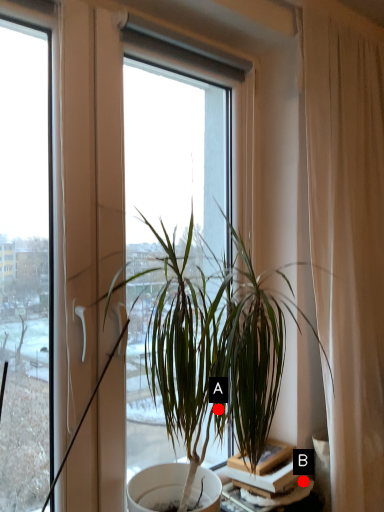
Question: Two points are circled on the image, labeled by A and B beside each circle. Which point is farther from the camera taking this photo?

Choices:
 (A) A is further
 (B) B is further

Answer: (B)